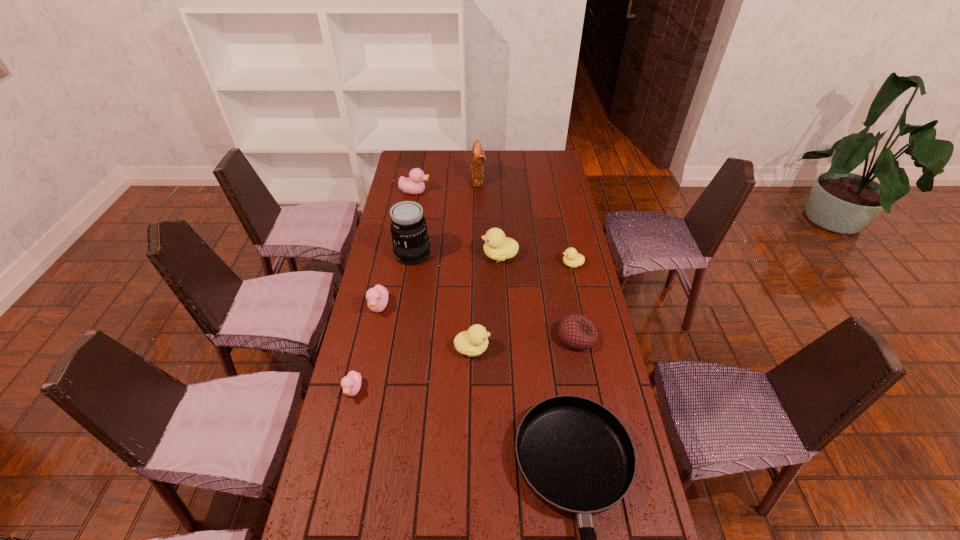
You are a GUI agent. You are given a task and a screenshot of the screen. Output one action in this format:
    pyautogui.click(x=<x>, y=<y>)
    Task: Click on the duckling located in the right edge section of the desktop
    
    Given the screenshot: What is the action you would take?
    pyautogui.click(x=571, y=258)

Find the location of a particular element. vacant space at the far edge of the desktop is located at coordinates (519, 157).

In the image, there is a desktop. What are the coordinates of `free space at the left edge` in the screenshot? It's located at (384, 430).

What are the coordinates of `free space at the right edge of the desktop` in the screenshot? It's located at (599, 394).

The height and width of the screenshot is (540, 960). I want to click on vacant space at the far left corner, so click(420, 167).

Where is `vacant space at the far right corner of the desktop`? vacant space at the far right corner of the desktop is located at coordinates (545, 159).

Where is `vacant area that lies between the nearest pink duckling and the tallest object`? The height and width of the screenshot is (540, 960). vacant area that lies between the nearest pink duckling and the tallest object is located at coordinates (383, 322).

Identify the location of free spot between the second biggest yellow duckling and the biggest yellow duckling. The height and width of the screenshot is (540, 960). (486, 302).

What are the coordinates of `free space between the nearest duckling and the biggest yellow duckling` in the screenshot? It's located at (426, 322).

The image size is (960, 540). I want to click on free space between the nearest yellow duckling and the smallest pink duckling, so click(x=413, y=369).